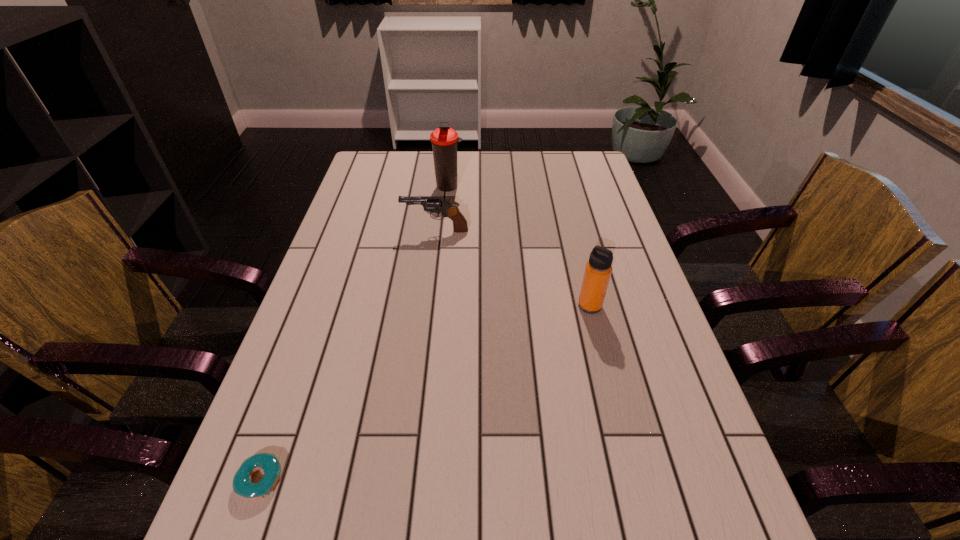
Image resolution: width=960 pixels, height=540 pixels. What are the coordinates of `vacant region at the far left corner of the desktop` in the screenshot? It's located at (372, 152).

At what (x,y) coordinates should I click in order to perform the action: click on empty space that is in between the taller thermos bottle and the right thermos bottle. Please return your answer as a coordinate pair (x, y). The height and width of the screenshot is (540, 960). Looking at the image, I should click on (519, 246).

At what (x,y) coordinates should I click in order to perform the action: click on empty location between the second shortest object and the nearer thermos bottle. Please return your answer as a coordinate pair (x, y). Image resolution: width=960 pixels, height=540 pixels. Looking at the image, I should click on (513, 268).

This screenshot has height=540, width=960. What are the coordinates of `empty space that is in between the shorter thermos bottle and the third tallest object` in the screenshot? It's located at (513, 268).

Identify the location of vacant point located between the tallest object and the doughnut. Image resolution: width=960 pixels, height=540 pixels. (354, 333).

The width and height of the screenshot is (960, 540). I want to click on free space between the doughnut and the farther thermos bottle, so click(x=354, y=333).

You are a GUI agent. You are given a task and a screenshot of the screen. Output one action in this format:
    pyautogui.click(x=<x>, y=<y>)
    Task: Click on the free point between the right thermos bottle and the gun
    
    Given the screenshot: What is the action you would take?
    pyautogui.click(x=513, y=268)

Locate an element on the screen. object that is the third closest to the left thermos bottle is located at coordinates (269, 463).

Select which object is the second closest to the nearest object. Please provide its 2D coordinates. Your answer should be formatted as a tuple, i.e. [(x, y)], where the tuple contains the x and y coordinates of a point satisfying the conditions above.

[(598, 269)]

The image size is (960, 540). Find the location of `free space that satisfies the following two spatial constraints: 1. along the barrel of the taller thermos bottle; 2. on the right side of the second farthest object`. free space that satisfies the following two spatial constraints: 1. along the barrel of the taller thermos bottle; 2. on the right side of the second farthest object is located at coordinates (441, 186).